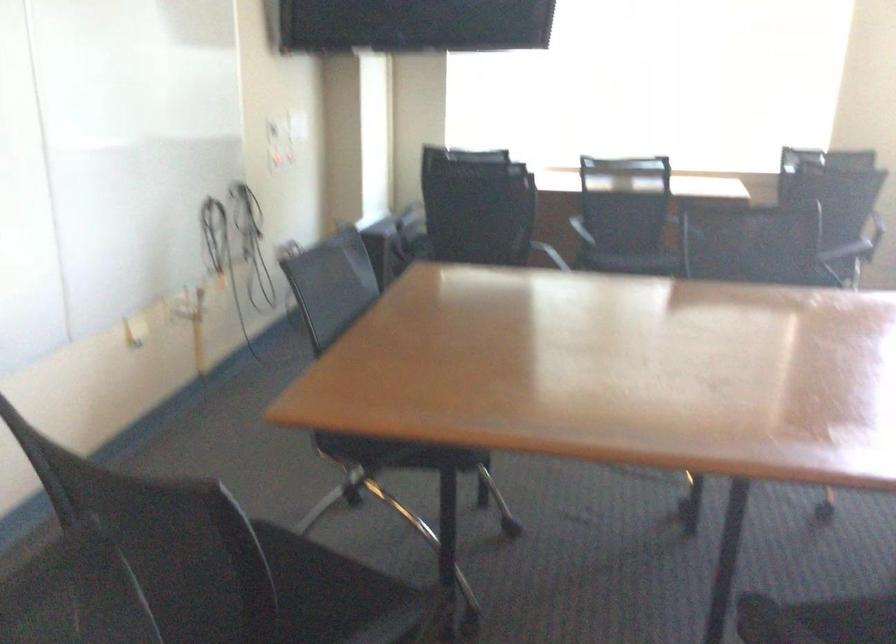
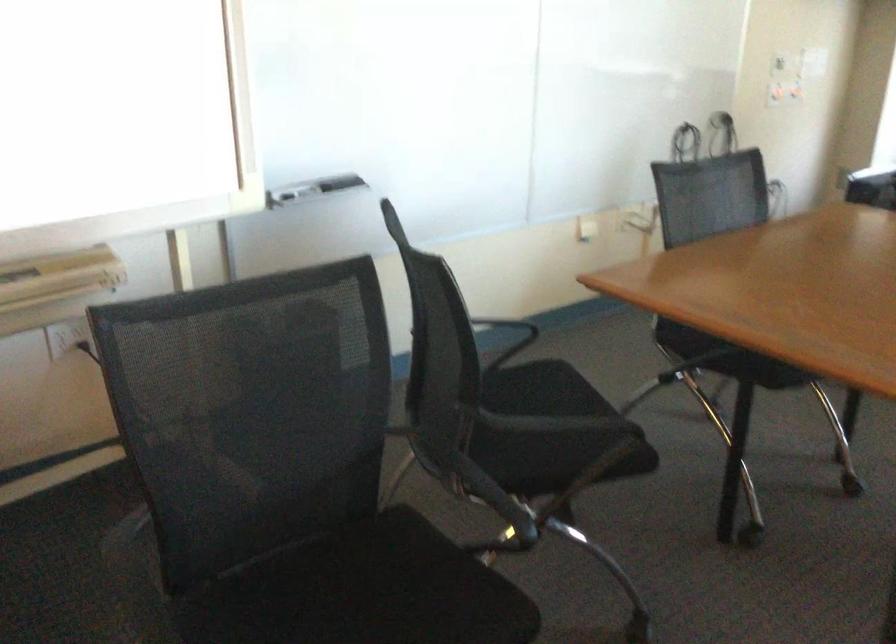
Locate, in the second image, the point that corresponds to the point at 412,460 in the first image.

(728, 357)